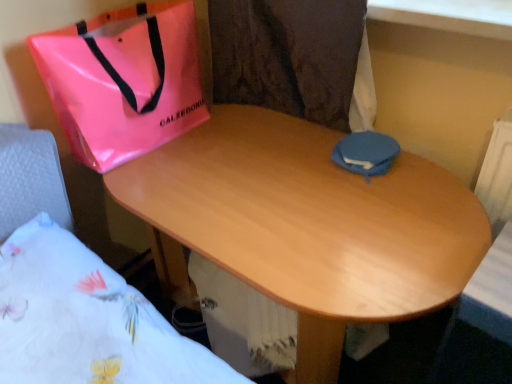
Question: Can you confirm if wooden desk at center is taller than white floral fabric at lower left?

Choices:
 (A) no
 (B) yes

Answer: (B)

Question: Considering the relative sizes of wooden desk at center and white floral fabric at lower left in the image provided, is wooden desk at center bigger than white floral fabric at lower left?

Choices:
 (A) yes
 (B) no

Answer: (A)

Question: From a real-world perspective, is wooden desk at center under white floral fabric at lower left?

Choices:
 (A) yes
 (B) no

Answer: (A)

Question: Does wooden desk at center have a lesser width compared to white floral fabric at lower left?

Choices:
 (A) no
 (B) yes

Answer: (A)

Question: Can you confirm if wooden desk at center is positioned to the right of white floral fabric at lower left?

Choices:
 (A) yes
 (B) no

Answer: (A)

Question: From a real-world perspective, is wooden desk at center physically located above or below white floral fabric at lower left?

Choices:
 (A) below
 (B) above

Answer: (A)

Question: From the image's perspective, is wooden desk at center located above or below white floral fabric at lower left?

Choices:
 (A) below
 (B) above

Answer: (B)

Question: Is wooden desk at center in front of or behind white floral fabric at lower left in the image?

Choices:
 (A) front
 (B) behind

Answer: (B)

Question: In terms of size, does wooden desk at center appear bigger or smaller than white floral fabric at lower left?

Choices:
 (A) small
 (B) big

Answer: (B)

Question: Considering the positions of point (374, 173) and point (315, 251), is point (374, 173) closer or farther from the camera than point (315, 251)?

Choices:
 (A) farther
 (B) closer

Answer: (A)

Question: From a real-world perspective, is blue fabric pouch at center positioned above or below wooden desk at center?

Choices:
 (A) below
 (B) above

Answer: (B)

Question: In terms of height, does blue fabric pouch at center look taller or shorter compared to wooden desk at center?

Choices:
 (A) short
 (B) tall

Answer: (A)

Question: Relative to wooden desk at center, is blue fabric pouch at center in front or behind?

Choices:
 (A) front
 (B) behind

Answer: (B)

Question: From a real-world perspective, relative to blue fabric pouch at center, is pink glossy bag at upper left vertically above or below?

Choices:
 (A) above
 (B) below

Answer: (A)

Question: Is pink glossy bag at upper left to the left or to the right of blue fabric pouch at center in the image?

Choices:
 (A) left
 (B) right

Answer: (A)